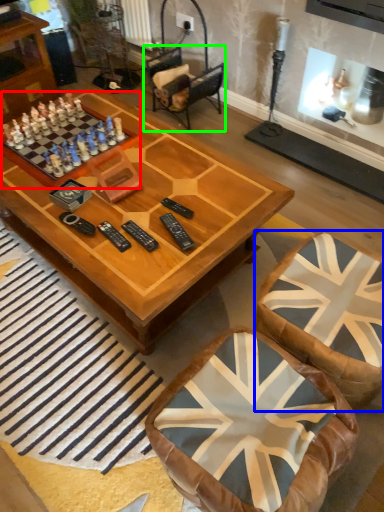
Question: Considering the real-world distances, which object is closest to board game (highlighted by a red box)? swivel chair (highlighted by a blue box) or armchair (highlighted by a green box).

Choices:
 (A) swivel chair
 (B) armchair

Answer: (B)